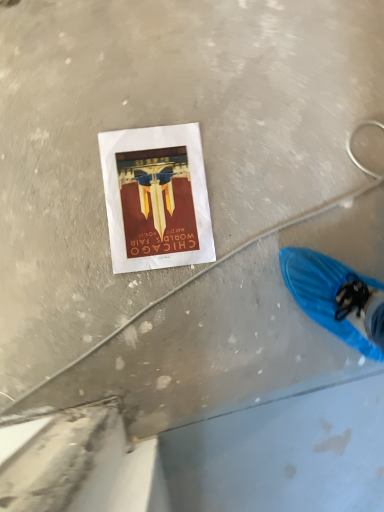
Image resolution: width=384 pixels, height=512 pixels. Find the location of `free space above matte paper poster at center (from a real-world perspective)`. free space above matte paper poster at center (from a real-world perspective) is located at coordinates (157, 196).